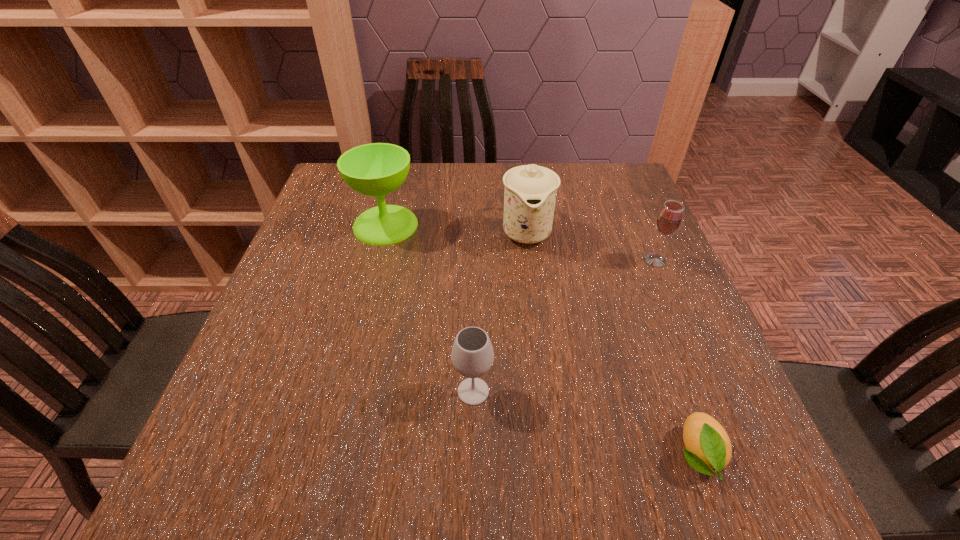
This screenshot has height=540, width=960. Find the location of `chinaware`. chinaware is located at coordinates (530, 192).

I want to click on the leftmost wineglass, so click(x=376, y=169).

Identify the location of the leftmost object. (376, 169).

Where is `the second nearest wineglass`? The height and width of the screenshot is (540, 960). the second nearest wineglass is located at coordinates (669, 218).

Where is `the second object from left to right`? The height and width of the screenshot is (540, 960). the second object from left to right is located at coordinates (472, 355).

This screenshot has height=540, width=960. I want to click on the fourth farthest object, so click(x=472, y=355).

The width and height of the screenshot is (960, 540). What are the coordinates of `the nearest object` in the screenshot? It's located at (708, 448).

Where is `the shortest object`? the shortest object is located at coordinates (708, 448).

Where is `vacant space situated 0.150m on the spout of the third object from right to left`? Image resolution: width=960 pixels, height=540 pixels. vacant space situated 0.150m on the spout of the third object from right to left is located at coordinates (535, 303).

Find the location of a particular element. The height and width of the screenshot is (540, 960). vacant space located 0.170m on the right of the leftmost object is located at coordinates (484, 225).